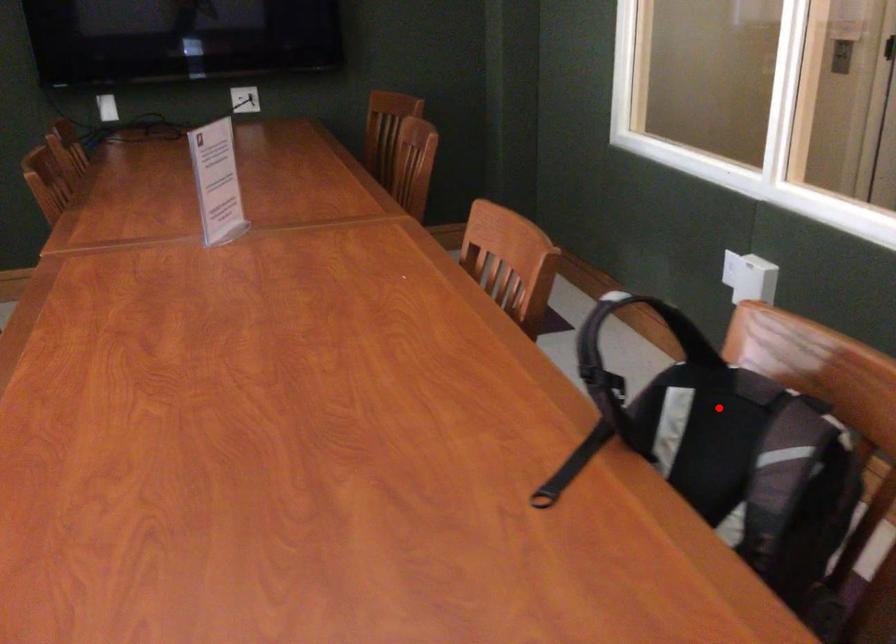
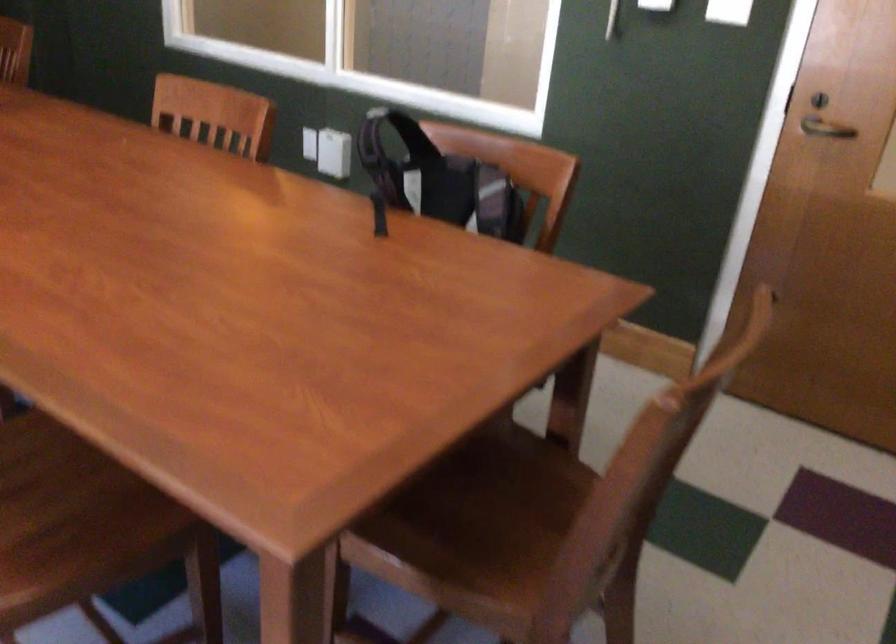
In the second image, find the point that corresponds to the highlighted location in the first image.

(438, 180)